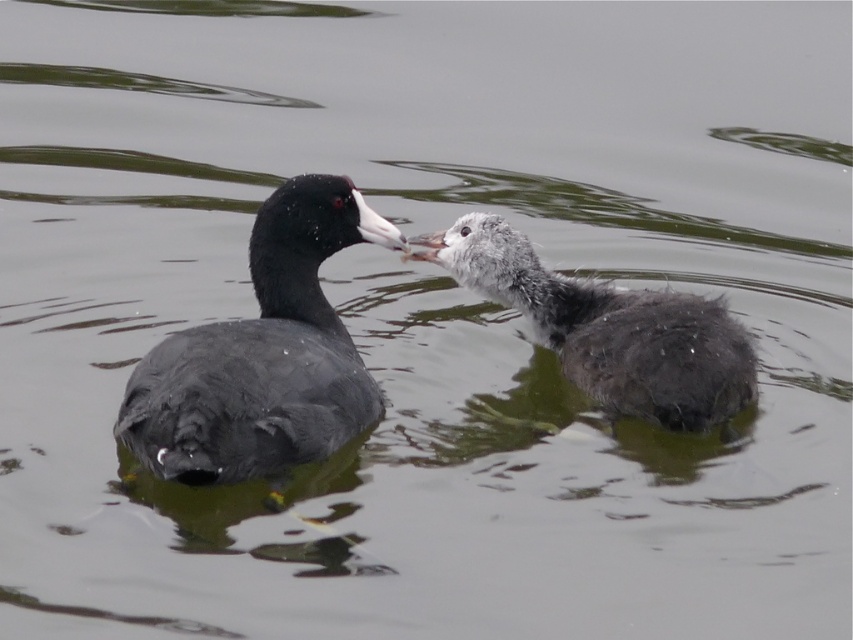
You are a photographer trying to capture a closeup of the gray fluffy duckling at center. There is a matte black duckling at left blocking your view. Which direction should you move to get a clear shot?

The matte black duckling at left is to the left of the gray fluffy duckling at center. To get a clear shot of the gray fluffy duckling at center, you should move to the right side to avoid the obstruction.

You are a wildlife photographer observing two ducklings in a pond. You have a camera with a zoom lens that can focus on objects up to 2 meters away. The distance between you and the matte black duckling at left is 1.8 meters. Can you clearly capture the gray fluffy duckling at center without moving closer?

The matte black duckling at left is much taller than the gray fluffy duckling at center. Since the matte black duckling is closer to you at 1.8 meters within the camera range, and the gray fluffy duckling at center is farther away, you might not be able to focus on it clearly without moving closer.